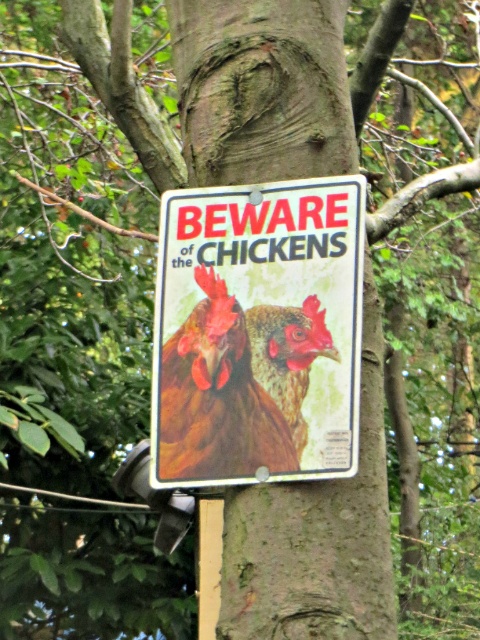
Question: Which point is closer to the camera taking this photo?

Choices:
 (A) (250, 369)
 (B) (310, 301)

Answer: (B)

Question: Does metallic signboard at center have a larger size compared to brown feathered chicken at center?

Choices:
 (A) no
 (B) yes

Answer: (B)

Question: Considering the real-world distances, which object is closest to the brown matte chicken at center?

Choices:
 (A) brown feathered chicken at center
 (B) metallic signboard at center

Answer: (A)

Question: Among these points, which one is farthest from the camera?

Choices:
 (A) (252, 436)
 (B) (295, 316)
 (C) (241, 241)

Answer: (C)

Question: Is metallic signboard at center thinner than brown feathered chicken at center?

Choices:
 (A) yes
 (B) no

Answer: (B)

Question: Can you confirm if brown feathered chicken at center is positioned above brown matte chicken at center?

Choices:
 (A) yes
 (B) no

Answer: (B)